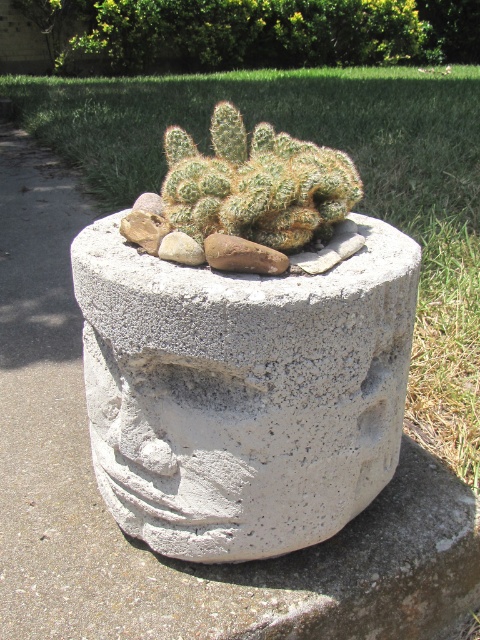
You are a gardener holding a watering can that can spray water up to 1 meter. You need to water the white concrete planter at center. Can you reach it without moving closer?

The white concrete planter at center is 1.08 meters away from the viewer. Since the watering can can only spray up to 1 meter, you cannot reach it without moving closer.

You are a gardener checking the growth of plants. You notice the white concrete planter at center and the green spiky cactus at center. Which one has a greater height?

The green spiky cactus at center is taller than the white concrete planter at center.

Consider the image. You are a gardener trying to place a new decorative stone between the white concrete planter at center and the green spiky cactus at center. Based on their positions, which object should you move closer to the other to create space?

The white concrete planter at center is positioned on the right side of the green spiky cactus at center, so you should move the white concrete planter at center closer to the green spiky cactus at center to create space for the decorative stone.